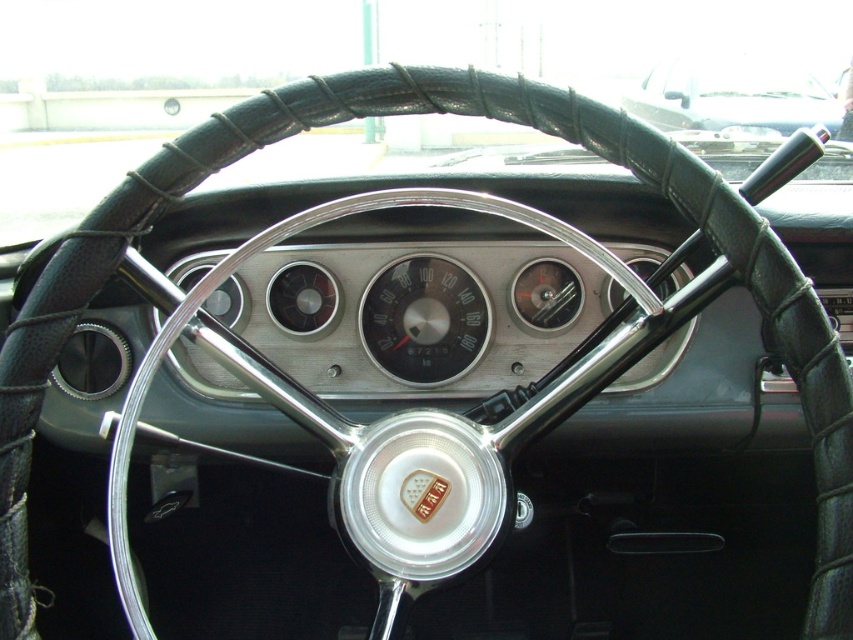
Question: Considering the relative positions of black leather steering wheel at upper center and matte silver gauge at center in the image provided, where is black leather steering wheel at upper center located with respect to matte silver gauge at center?

Choices:
 (A) right
 (B) left

Answer: (A)

Question: Which point is closer to the camera?

Choices:
 (A) matte silver gauge at center
 (B) black leather steering wheel at upper center

Answer: (A)

Question: Can you confirm if black leather steering wheel at upper center is bigger than matte silver gauge at center?

Choices:
 (A) no
 (B) yes

Answer: (B)

Question: Does black leather steering wheel at upper center have a greater width compared to matte silver gauge at center?

Choices:
 (A) no
 (B) yes

Answer: (B)

Question: Which point is closer to the camera?

Choices:
 (A) (445, 310)
 (B) (782, 124)

Answer: (A)